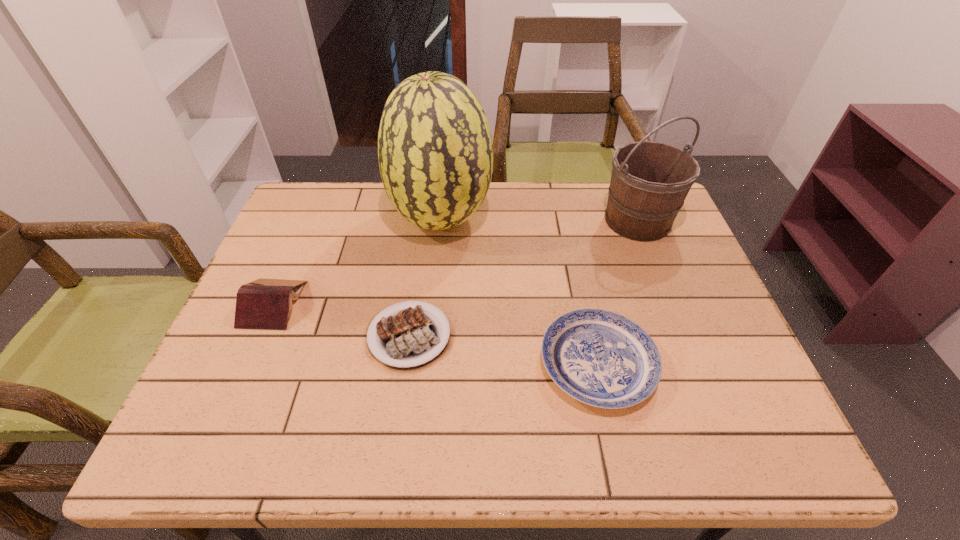
Find the location of a particular element. This screenshot has width=960, height=540. vacant space that is in between the book and the tallest object is located at coordinates (357, 261).

Where is `empty space between the second tallest object and the tallest object`? The width and height of the screenshot is (960, 540). empty space between the second tallest object and the tallest object is located at coordinates (540, 220).

Where is `empty space between the bucket and the right plate`? This screenshot has width=960, height=540. empty space between the bucket and the right plate is located at coordinates (617, 292).

Where is `object that stands as the third closest to the shortest object`? object that stands as the third closest to the shortest object is located at coordinates (600, 358).

Identify which object is located as the fourth nearest to the shorter plate. Please provide its 2D coordinates. Your answer should be formatted as a tuple, i.e. [(x, y)], where the tuple contains the x and y coordinates of a point satisfying the conditions above.

[(649, 182)]

Find the location of a particular element. The width and height of the screenshot is (960, 540). vacant area in the image that satisfies the following two spatial constraints: 1. on the back side of the bucket; 2. on the left side of the left plate is located at coordinates (425, 221).

Find the location of a particular element. vacant region that satisfies the following two spatial constraints: 1. on the front side of the second shortest object; 2. on the right side of the shortest object is located at coordinates (405, 363).

The height and width of the screenshot is (540, 960). I want to click on vacant space that satisfies the following two spatial constraints: 1. on the back side of the tallest object; 2. on the right side of the leftmost object, so click(x=309, y=219).

This screenshot has height=540, width=960. Identify the location of vacant space that satisfies the following two spatial constraints: 1. on the front side of the right plate; 2. on the right side of the shorter plate. [x=405, y=363].